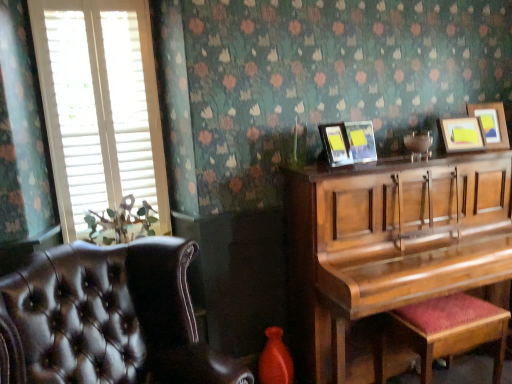
Where is `matte black picture frame at upper center, the third picture frame viewed from the right`? matte black picture frame at upper center, the third picture frame viewed from the right is located at coordinates (361, 141).

Measure the distance between matte black picture frame at upper center, the 2th picture frame from the left, and camera.

They are 2.22 meters apart.

Locate an element on the screen. This screenshot has width=512, height=384. wooden picture frame at upper right, which ranks as the 1th picture frame in left-to-right order is located at coordinates (335, 144).

The width and height of the screenshot is (512, 384). What do you see at coordinates (389, 244) in the screenshot?
I see `shiny brown piano at right` at bounding box center [389, 244].

Measure the distance between point (108, 253) and camera.

Point (108, 253) is 5.88 feet from camera.

Where is `matte black picture frame at upper center, the 2th picture frame from the left`? This screenshot has width=512, height=384. matte black picture frame at upper center, the 2th picture frame from the left is located at coordinates (361, 141).

How many degrees apart are the facing directions of velvet red music stool at lower right and wooden picture frame at upper right, acting as the 4th picture frame starting from the left?

The facing directions of velvet red music stool at lower right and wooden picture frame at upper right, acting as the 4th picture frame starting from the left, are 166 degrees apart.

Which of these two, velvet red music stool at lower right or wooden picture frame at upper right, acting as the 4th picture frame starting from the left, is wider?

velvet red music stool at lower right.

The image size is (512, 384). I want to click on the 4th picture frame above when counting from the velvet red music stool at lower right (from the image's perspective), so click(x=490, y=123).

Which of these two, velvet red music stool at lower right or wooden picture frame at upper right, arranged as the first picture frame when viewed from the right, is smaller?

wooden picture frame at upper right, arranged as the first picture frame when viewed from the right.

Is white wood blinds at left wider or thinner than leather at left?

Clearly, white wood blinds at left has less width compared to leather at left.

Based on the photo, is white wood blinds at left outside of leather at left?

Yes, white wood blinds at left is not within leather at left.

Does white wood blinds at left lie in front of leather at left?

That is False.

From the image's perspective, is white wood blinds at left located above or below leather at left?

white wood blinds at left is situated higher than leather at left in the image.

From a real-world perspective, who is located higher, velvet red music stool at lower right or wooden picture frame at upper right, which ranks as the 1th picture frame in left-to-right order?

wooden picture frame at upper right, which ranks as the 1th picture frame in left-to-right order, from a real-world perspective.

Is velvet red music stool at lower right turned away from wooden picture frame at upper right, which ranks as the 4th picture frame in right-to-left order?

No, velvet red music stool at lower right's orientation is not away from wooden picture frame at upper right, which ranks as the 4th picture frame in right-to-left order.

Measure the distance between velvet red music stool at lower right and wooden picture frame at upper right, which ranks as the 1th picture frame in left-to-right order.

37.67 inches.

Is velvet red music stool at lower right located outside wooden picture frame at upper right, which ranks as the 4th picture frame in right-to-left order?

Absolutely, velvet red music stool at lower right is external to wooden picture frame at upper right, which ranks as the 4th picture frame in right-to-left order.

Is point (502, 119) positioned before point (474, 127)?

No, (502, 119) is behind (474, 127).

Considering the relative sizes of wooden picture frame at upper right, acting as the 4th picture frame starting from the left, and wooden picture frame at upper right, placed as the 3th picture frame when sorted from left to right, in the image provided, is wooden picture frame at upper right, acting as the 4th picture frame starting from the left, smaller than wooden picture frame at upper right, placed as the 3th picture frame when sorted from left to right,?

No.

From the image's perspective, between wooden picture frame at upper right, acting as the 4th picture frame starting from the left, and wooden picture frame at upper right, placed as the 3th picture frame when sorted from left to right, who is located below?

wooden picture frame at upper right, placed as the 3th picture frame when sorted from left to right, from the image's perspective.

Is wooden picture frame at upper right, arranged as the first picture frame when viewed from the right, further to camera compared to wooden picture frame at upper right, the 2th picture frame when ordered from right to left?

Yes, wooden picture frame at upper right, arranged as the first picture frame when viewed from the right, is behind wooden picture frame at upper right, the 2th picture frame when ordered from right to left.

Between point (331, 139) and point (468, 148), which one is positioned behind?

The point (468, 148) is behind.

From the image's perspective, which one is positioned lower, wooden picture frame at upper right, which ranks as the 1th picture frame in left-to-right order, or wooden picture frame at upper right, placed as the 3th picture frame when sorted from left to right?

wooden picture frame at upper right, which ranks as the 1th picture frame in left-to-right order, from the image's perspective.

In the scene shown: In terms of size, does wooden picture frame at upper right, which ranks as the 4th picture frame in right-to-left order, appear bigger or smaller than wooden picture frame at upper right, placed as the 3th picture frame when sorted from left to right?

Considering their sizes, wooden picture frame at upper right, which ranks as the 4th picture frame in right-to-left order, takes up less space than wooden picture frame at upper right, placed as the 3th picture frame when sorted from left to right.

Can you confirm if wooden picture frame at upper right, placed as the 3th picture frame when sorted from left to right, is shorter than leather at left?

Correct, wooden picture frame at upper right, placed as the 3th picture frame when sorted from left to right, is not as tall as leather at left.

Considering the positions of objects wooden picture frame at upper right, the 2th picture frame when ordered from right to left, and leather at left in the image provided, who is more to the left, wooden picture frame at upper right, the 2th picture frame when ordered from right to left, or leather at left?

leather at left is more to the left.

From the image's perspective, is wooden picture frame at upper right, the 2th picture frame when ordered from right to left, below leather at left?

Actually, wooden picture frame at upper right, the 2th picture frame when ordered from right to left, appears above leather at left in the image.

How many degrees apart are the facing directions of wooden picture frame at upper right, placed as the 3th picture frame when sorted from left to right, and matte black picture frame at upper center, the 2th picture frame from the left?

wooden picture frame at upper right, placed as the 3th picture frame when sorted from left to right, and matte black picture frame at upper center, the 2th picture frame from the left, are facing 16.6 degrees away from each other.

Which is less distant, (449, 127) or (352, 155)?

The point (352, 155) is closer.

Considering the sizes of objects wooden picture frame at upper right, placed as the 3th picture frame when sorted from left to right, and matte black picture frame at upper center, the 2th picture frame from the left, in the image provided, who is smaller, wooden picture frame at upper right, placed as the 3th picture frame when sorted from left to right, or matte black picture frame at upper center, the 2th picture frame from the left,?

matte black picture frame at upper center, the 2th picture frame from the left, is smaller.

From a real-world perspective, who is located higher, wooden picture frame at upper right, the 2th picture frame when ordered from right to left, or matte black picture frame at upper center, the 2th picture frame from the left?

In real-world perspective, wooden picture frame at upper right, the 2th picture frame when ordered from right to left, is above.

Locate an element on the screen. The width and height of the screenshot is (512, 384). the 4th picture frame positioned above the velvet red music stool at lower right (from a real-world perspective) is located at coordinates (490, 123).

Identify the location of chair below the white wood blinds at left (from the image's perspective). (113, 316).

Based on their spatial positions, is wooden picture frame at upper right, which ranks as the 1th picture frame in left-to-right order, or white wood blinds at left further from velvet red music stool at lower right?

white wood blinds at left.

Looking at the image, which one is located closer to wooden picture frame at upper right, the 2th picture frame when ordered from right to left, velvet red music stool at lower right or matte black picture frame at upper center, the 2th picture frame from the left?

matte black picture frame at upper center, the 2th picture frame from the left, lies closer to wooden picture frame at upper right, the 2th picture frame when ordered from right to left, than the other object.

Considering their positions, is wooden picture frame at upper right, acting as the 4th picture frame starting from the left, positioned further to wooden picture frame at upper right, which ranks as the 4th picture frame in right-to-left order, than matte black picture frame at upper center, the third picture frame viewed from the right?

wooden picture frame at upper right, acting as the 4th picture frame starting from the left, is positioned further to the anchor wooden picture frame at upper right, which ranks as the 4th picture frame in right-to-left order.

Looking at the image, which one is located further to shiny brown piano at right, wooden picture frame at upper right, arranged as the first picture frame when viewed from the right, or wooden picture frame at upper right, the 2th picture frame when ordered from right to left?

wooden picture frame at upper right, arranged as the first picture frame when viewed from the right, is further to shiny brown piano at right.

Estimate the real-world distances between objects in this image. Which object is closer to leather at left, velvet red music stool at lower right or white wood blinds at left?

white wood blinds at left lies closer to leather at left than the other object.

Looking at this image, which object lies further to the anchor point matte black picture frame at upper center, the third picture frame viewed from the right, leather at left or wooden picture frame at upper right, which ranks as the 4th picture frame in right-to-left order?

Based on the image, leather at left appears to be further to matte black picture frame at upper center, the third picture frame viewed from the right.

Considering their positions, is wooden picture frame at upper right, acting as the 4th picture frame starting from the left, positioned further to wooden picture frame at upper right, the 2th picture frame when ordered from right to left, than wooden picture frame at upper right, which ranks as the 1th picture frame in left-to-right order?

The object further to wooden picture frame at upper right, the 2th picture frame when ordered from right to left, is wooden picture frame at upper right, which ranks as the 1th picture frame in left-to-right order.

Estimate the real-world distances between objects in this image. Which object is further from wooden picture frame at upper right, acting as the 4th picture frame starting from the left, wooden picture frame at upper right, placed as the 3th picture frame when sorted from left to right, or white wood blinds at left?

The object further to wooden picture frame at upper right, acting as the 4th picture frame starting from the left, is white wood blinds at left.

You are a GUI agent. You are given a task and a screenshot of the screen. Output one action in this format:
    pyautogui.click(x=<x>, y=<y>)
    Task: Click on the piano between leather at left and wooden picture frame at upper right, the 2th picture frame when ordered from right to left, from left to right
    This screenshot has width=512, height=384.
    Given the screenshot: What is the action you would take?
    pyautogui.click(x=389, y=244)

Identify the location of piano between wooden picture frame at upper right, which ranks as the 4th picture frame in right-to-left order, and wooden picture frame at upper right, arranged as the first picture frame when viewed from the right, in the horizontal direction. This screenshot has height=384, width=512. (389, 244).

Identify the location of picture frame situated between matte black picture frame at upper center, the third picture frame viewed from the right, and wooden picture frame at upper right, arranged as the first picture frame when viewed from the right, from left to right. (462, 134).

Image resolution: width=512 pixels, height=384 pixels. In order to click on window positioned between leather at left and wooden picture frame at upper right, which ranks as the 1th picture frame in left-to-right order, from near to far in this screenshot , I will do `click(100, 106)`.